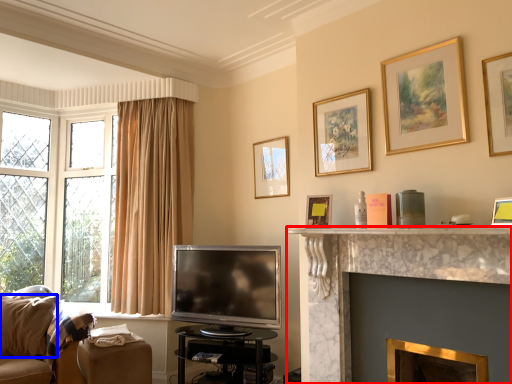
Question: Which object is closer to the camera taking this photo, fireplace (highlighted by a red box) or pillow (highlighted by a blue box)?

Choices:
 (A) fireplace
 (B) pillow

Answer: (A)